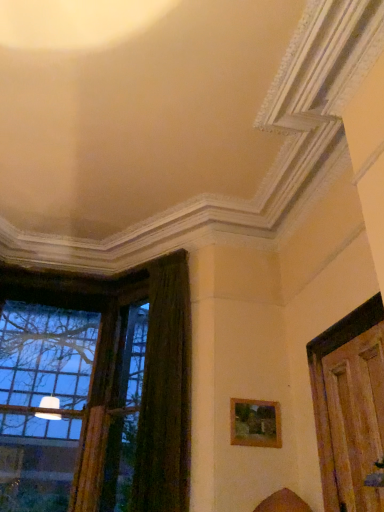
Question: From the image's perspective, is dark green velvet curtain at left on clear glass window at left?

Choices:
 (A) no
 (B) yes

Answer: (B)

Question: From a real-world perspective, is dark green velvet curtain at left under clear glass window at left?

Choices:
 (A) yes
 (B) no

Answer: (A)

Question: Is the position of dark green velvet curtain at left more distant than that of clear glass window at left?

Choices:
 (A) no
 (B) yes

Answer: (A)

Question: Is dark green velvet curtain at left looking in the opposite direction of clear glass window at left?

Choices:
 (A) yes
 (B) no

Answer: (B)

Question: From the image's perspective, is dark green velvet curtain at left located beneath clear glass window at left?

Choices:
 (A) no
 (B) yes

Answer: (A)

Question: Is dark green velvet curtain at left aimed at clear glass window at left?

Choices:
 (A) no
 (B) yes

Answer: (A)

Question: Is dark green velvet curtain at left located outside wooden picture frame at lower right?

Choices:
 (A) yes
 (B) no

Answer: (A)

Question: Considering the relative sizes of dark green velvet curtain at left and wooden picture frame at lower right in the image provided, is dark green velvet curtain at left taller than wooden picture frame at lower right?

Choices:
 (A) no
 (B) yes

Answer: (B)

Question: Does dark green velvet curtain at left contain wooden picture frame at lower right?

Choices:
 (A) yes
 (B) no

Answer: (B)

Question: Is the depth of dark green velvet curtain at left greater than that of wooden picture frame at lower right?

Choices:
 (A) no
 (B) yes

Answer: (A)

Question: Considering the relative sizes of dark green velvet curtain at left and wooden picture frame at lower right in the image provided, is dark green velvet curtain at left shorter than wooden picture frame at lower right?

Choices:
 (A) yes
 (B) no

Answer: (B)

Question: Is dark green velvet curtain at left positioned before wooden picture frame at lower right?

Choices:
 (A) yes
 (B) no

Answer: (A)

Question: Is wooden picture frame at lower right surrounding dark green velvet curtain at left?

Choices:
 (A) no
 (B) yes

Answer: (A)